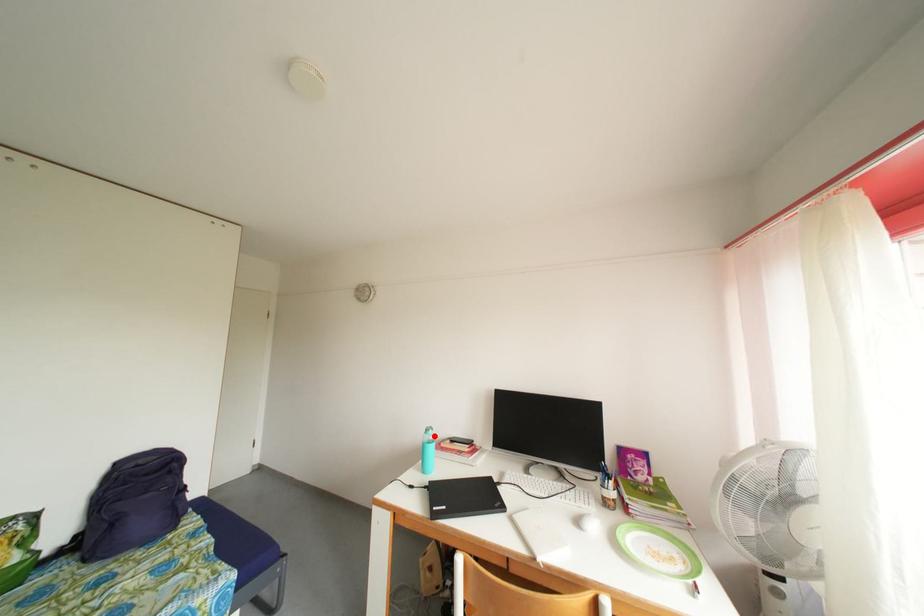
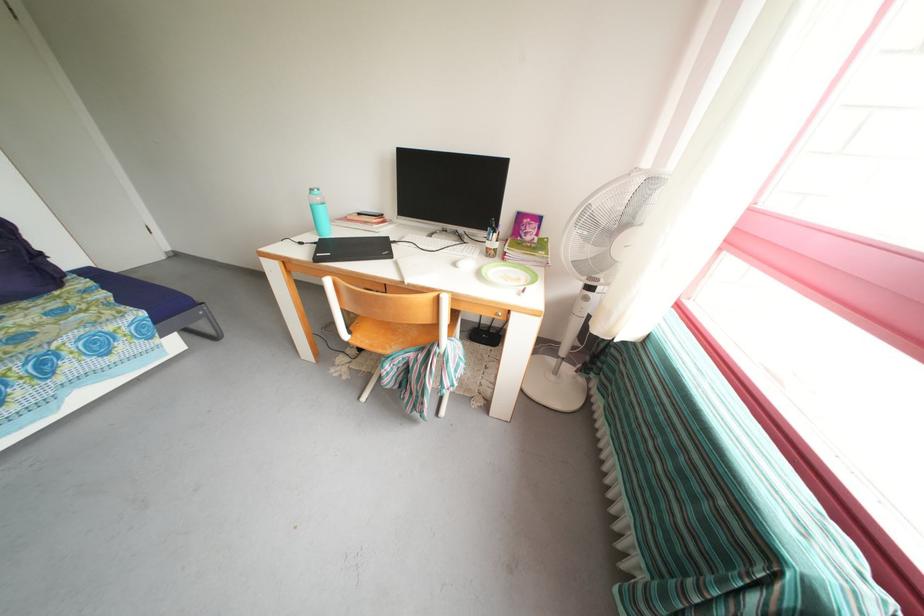
Question: I am providing you with two images of the same scene from different viewpoints. In image1, a red point is highlighted. Considering the same 3D point in image2, which of the following is correct?

Choices:
 (A) It is closer
 (B) It is farther

Answer: (A)